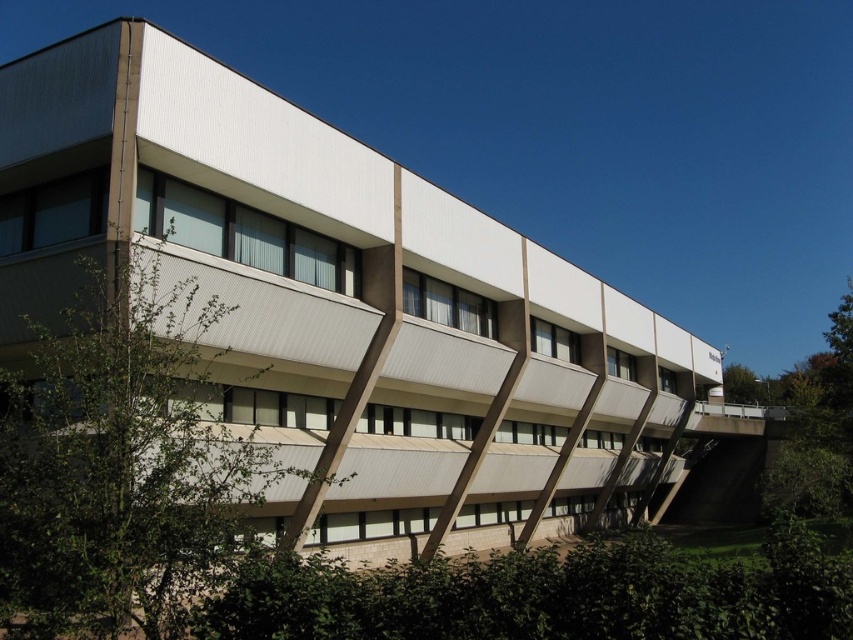
You are a landscape architect reviewing the building design. You notice two green leafy trees in the image. Which tree, the green leafy tree at center or the green leafy tree at upper right, would require more space for its root system based on their sizes?

The green leafy tree at upper right is larger than the green leafy tree at center, so it would require more space for its root system.

You are standing in front of the modern multi story building with a ramp entrance. You want to plant a new tree so that it is positioned exactly where the green leafy tree at center is currently located. What are the coordinates of the spot where you should plant the new tree?

The coordinates for the spot where you should plant the new tree are at point (120,461).